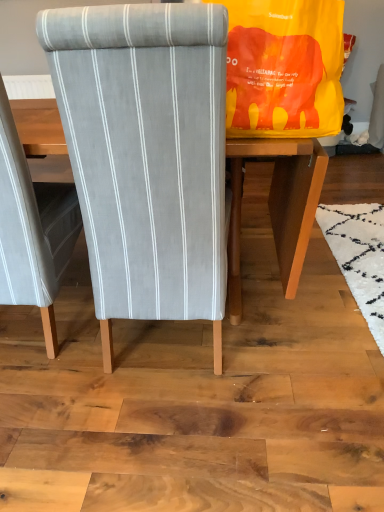
Question: Is yellow fabric bag at upper right to the left of gray fabric chair at center, which appears as the second chair when viewed from the left, from the viewer's perspective?

Choices:
 (A) yes
 (B) no

Answer: (B)

Question: Can gray fabric chair at center, which appears as the second chair when viewed from the left, be found inside yellow fabric bag at upper right?

Choices:
 (A) no
 (B) yes

Answer: (A)

Question: Is yellow fabric bag at upper right wider than gray fabric chair at center, which appears as the second chair when viewed from the left?

Choices:
 (A) no
 (B) yes

Answer: (A)

Question: Is yellow fabric bag at upper right positioned behind gray fabric chair at center, the 1th chair from the right?

Choices:
 (A) no
 (B) yes

Answer: (B)

Question: Does yellow fabric bag at upper right turn towards gray fabric chair at center, which appears as the second chair when viewed from the left?

Choices:
 (A) no
 (B) yes

Answer: (B)

Question: Is point (6, 264) closer or farther from the camera than point (132, 275)?

Choices:
 (A) closer
 (B) farther

Answer: (B)

Question: In terms of height, does textured gray fabric chair at center, which is counted as the 1th chair, starting from the left, look taller or shorter compared to gray fabric chair at center, which appears as the second chair when viewed from the left?

Choices:
 (A) short
 (B) tall

Answer: (A)

Question: Is textured gray fabric chair at center, which is counted as the 1th chair, starting from the left, in front of or behind gray fabric chair at center, which appears as the second chair when viewed from the left, in the image?

Choices:
 (A) behind
 (B) front

Answer: (A)

Question: Considering the positions of textured gray fabric chair at center, which is counted as the 1th chair, starting from the left, and gray fabric chair at center, which appears as the second chair when viewed from the left, in the image, is textured gray fabric chair at center, which is counted as the 1th chair, starting from the left, wider or thinner than gray fabric chair at center, which appears as the second chair when viewed from the left,?

Choices:
 (A) wide
 (B) thin

Answer: (B)

Question: In the image, is yellow fabric bag at upper right positioned in front of or behind gray fabric chair at center, the 1th chair from the right?

Choices:
 (A) behind
 (B) front

Answer: (A)

Question: Based on their sizes in the image, would you say yellow fabric bag at upper right is bigger or smaller than gray fabric chair at center, which appears as the second chair when viewed from the left?

Choices:
 (A) big
 (B) small

Answer: (B)

Question: From a real-world perspective, is yellow fabric bag at upper right physically located above or below gray fabric chair at center, which appears as the second chair when viewed from the left?

Choices:
 (A) above
 (B) below

Answer: (A)

Question: Is yellow fabric bag at upper right taller or shorter than gray fabric chair at center, which appears as the second chair when viewed from the left?

Choices:
 (A) tall
 (B) short

Answer: (B)

Question: Based on their positions, is gray fabric chair at center, which appears as the second chair when viewed from the left, located to the left or right of yellow fabric bag at upper right?

Choices:
 (A) right
 (B) left

Answer: (B)

Question: Is gray fabric chair at center, which appears as the second chair when viewed from the left, taller or shorter than yellow fabric bag at upper right?

Choices:
 (A) tall
 (B) short

Answer: (A)